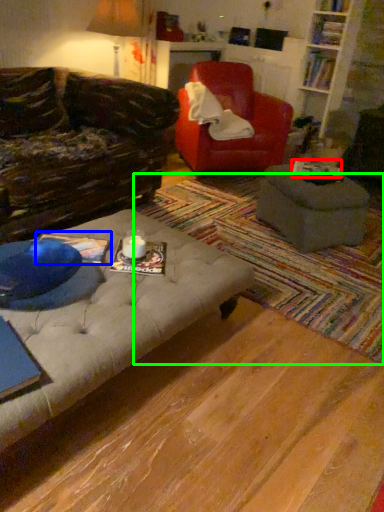
Question: Which is farther away from book (highlighted by a red box)? book (highlighted by a blue box) or mat (highlighted by a green box)?

Choices:
 (A) book
 (B) mat

Answer: (A)